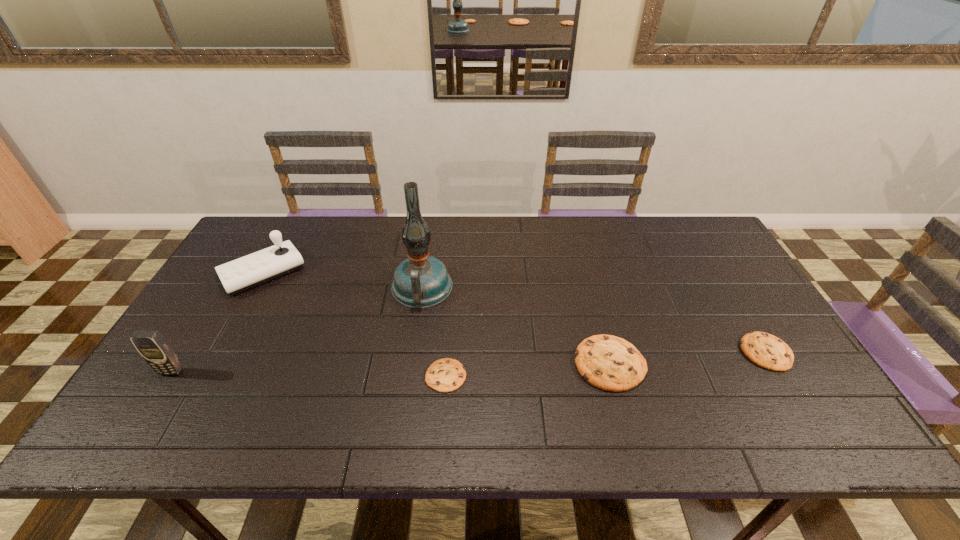
Identify the location of free point between the fifth shortest object and the rightmost object. This screenshot has height=540, width=960. (468, 362).

Find the location of `free space between the oil lamp and the second object from right to left`. free space between the oil lamp and the second object from right to left is located at coordinates (516, 326).

Where is `free space between the fifth tallest object and the third tallest object`? free space between the fifth tallest object and the third tallest object is located at coordinates (515, 312).

Where is `unoccupied position between the fourth shortest object and the second cookie from right to left`? The width and height of the screenshot is (960, 540). unoccupied position between the fourth shortest object and the second cookie from right to left is located at coordinates (437, 318).

Where is `vacant space that is in between the cellular telephone and the shortest object`? This screenshot has width=960, height=540. vacant space that is in between the cellular telephone and the shortest object is located at coordinates (309, 374).

Image resolution: width=960 pixels, height=540 pixels. I want to click on object that is the fourth nearest to the third tallest object, so click(610, 363).

Locate an element on the screen. The image size is (960, 540). object that is the closest to the tallest object is located at coordinates (445, 375).

Locate which cookie is the closest to the fourth tallest object. Please provide its 2D coordinates. Your answer should be formatted as a tuple, i.e. [(x, y)], where the tuple contains the x and y coordinates of a point satisfying the conditions above.

[(766, 350)]

You are a GUI agent. You are given a task and a screenshot of the screen. Output one action in this format:
    pyautogui.click(x=<x>, y=<y>)
    Task: Click on the cookie identified as the closest to the second cookie from left to right
    The height and width of the screenshot is (540, 960).
    Given the screenshot: What is the action you would take?
    pyautogui.click(x=766, y=350)

Image resolution: width=960 pixels, height=540 pixels. Identify the location of free spot that satisfies the following two spatial constraints: 1. on the front side of the oil lamp; 2. on the left side of the fourth shortest object. (254, 288).